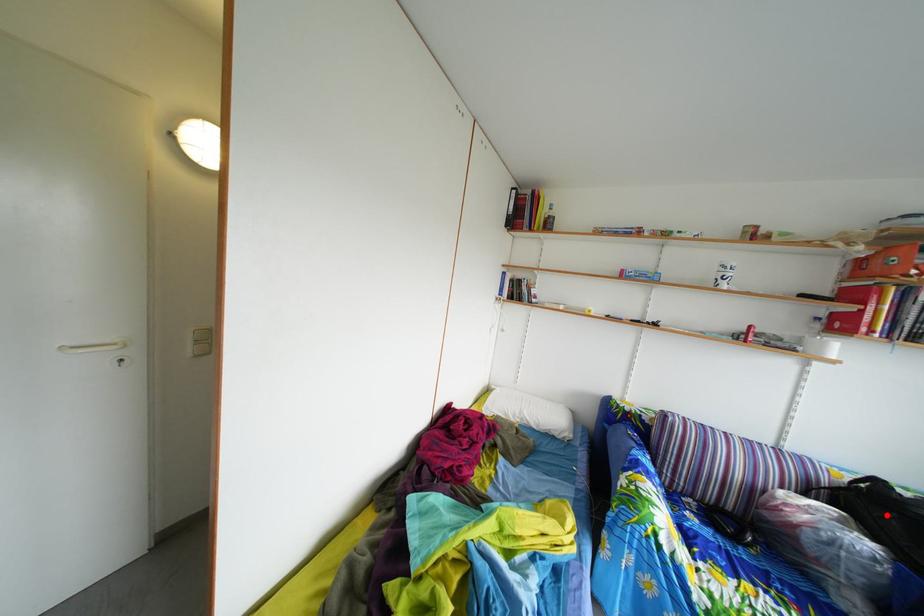
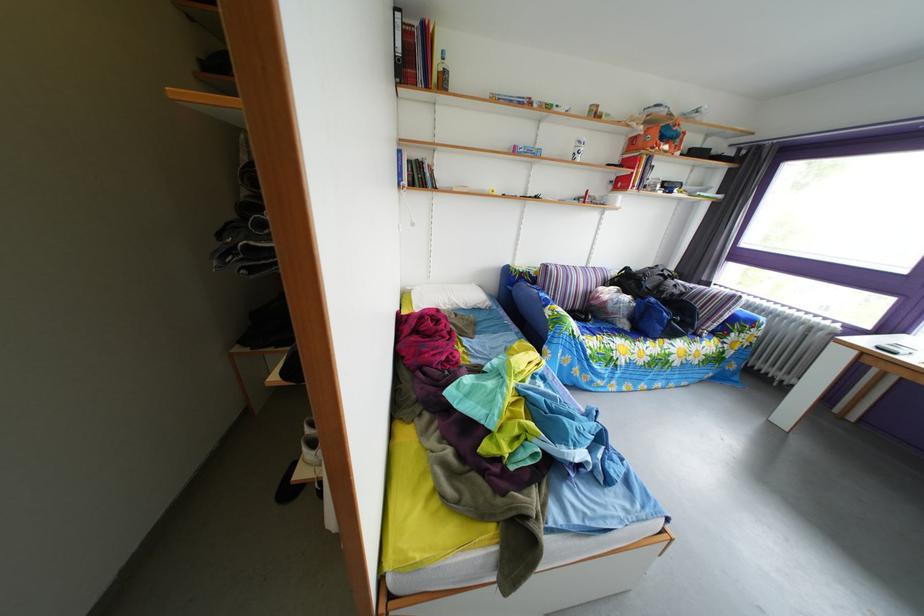
Question: I am providing you with two images of the same scene from different viewpoints. A red point is marked on the first image. At the location where the point appears in image 1, is it still visible in image 2?

Choices:
 (A) Yes
 (B) No

Answer: (A)